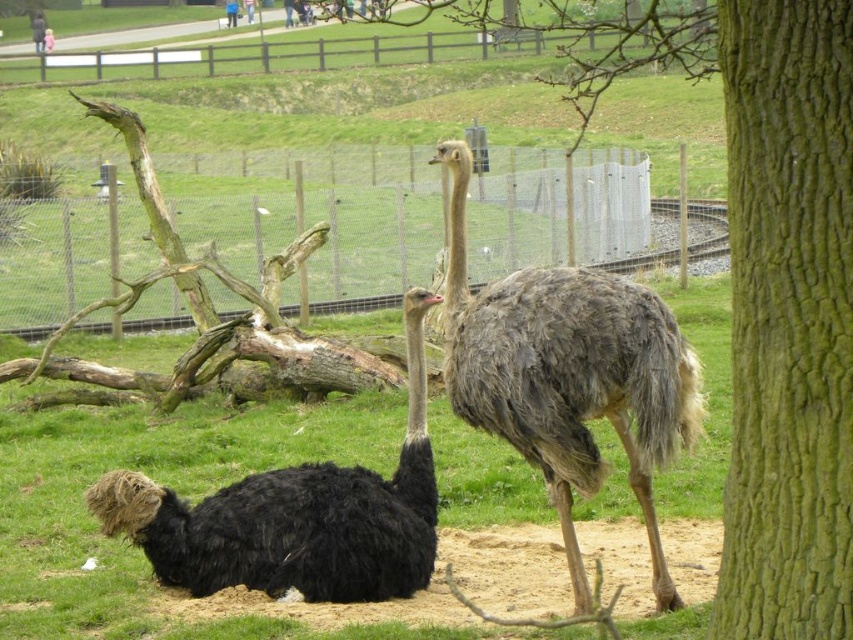
You are a zookeeper who needs to place a new feeding station between the green rough bark tree trunk at right and the metallic wire fence at upper center. Based on their positions, which object should the feeding station be closer to?

The green rough bark tree trunk at right is positioned on the right side of the metallic wire fence at upper center, so the feeding station should be placed closer to the metallic wire fence at upper center to ensure it is between both objects.

You are a zookeeper who needs to place a feeding tray between the green rough bark tree trunk at right and the brown feathered ostrich at center. Can you position it in the middle between them?

The green rough bark tree trunk at right is to the right of the brown feathered ostrich at center, so yes, you can position the feeding tray in the middle between them as there is space between the two objects.